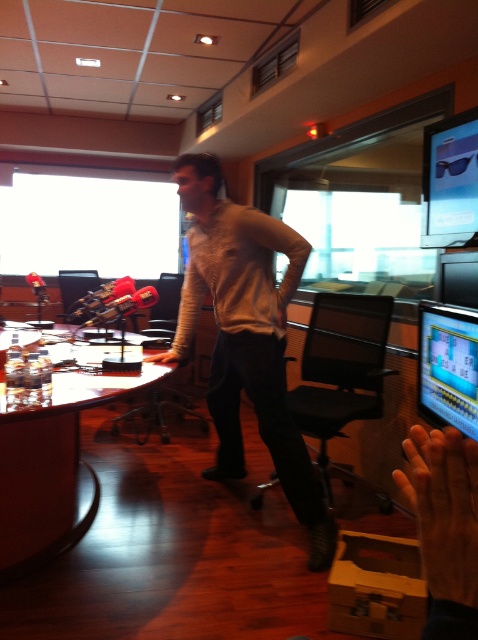
Consider the image. You are setting up a photo shoot in this room and need to ensure that the light beige sweater at center and the matte black monitor at right are both visible in the frame. Given their sizes, which object should you prioritize positioning closer to the camera to ensure clarity?

The light beige sweater at center is larger in size than the matte black monitor at right, so you should prioritize positioning the matte black monitor at right closer to the camera to ensure clarity since it is smaller and may need better focus.

You are setting up a camera in the studio to capture both the light beige sweater at center and the matte black monitor at right. Since the camera can only focus on objects of a certain height, which object should you adjust the focus for first based on their heights?

The light beige sweater at center has a greater height compared to the matte black monitor at right, so you should adjust the focus for the light beige sweater at center first since it is taller.

You are setting up a photography shoot in the studio and need to place a matte black monitor at right and a pair of satin black sunglasses at upper right. Given their sizes, which object should you position closer to the camera to ensure both are clearly visible in the photo?

The matte black monitor at right is smaller than the satin black sunglasses at upper right, so you should position the matte black monitor at right closer to the camera to compensate for its smaller size and ensure both are clearly visible.